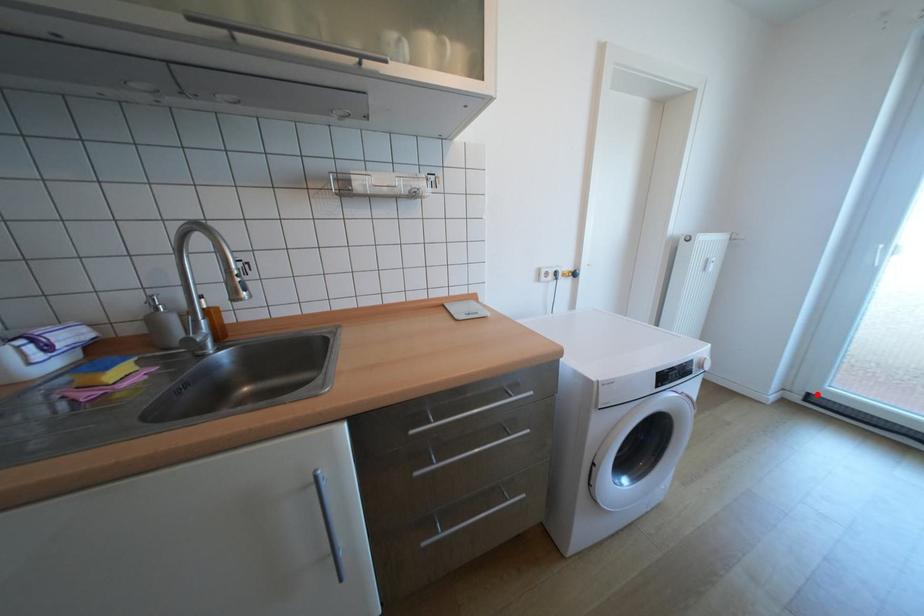
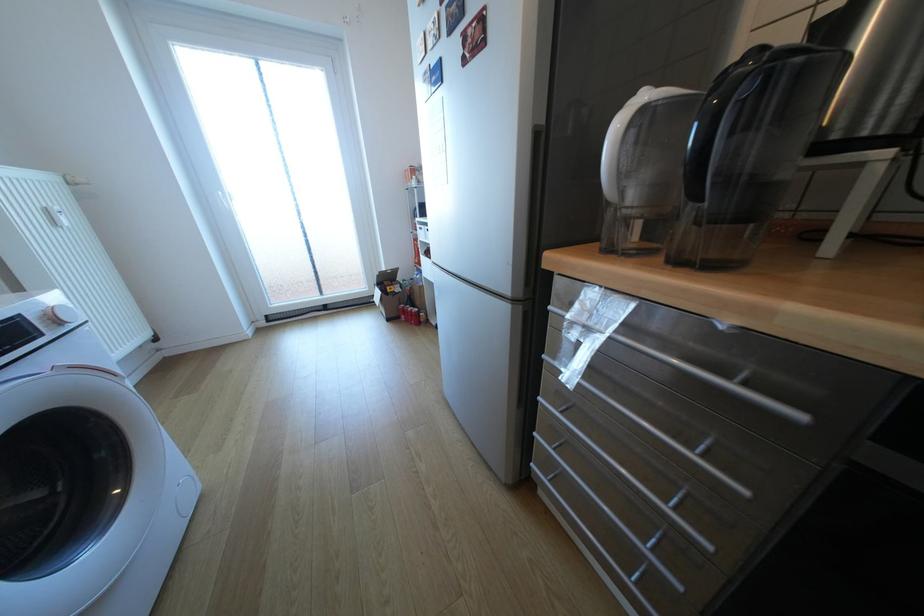
Question: I am providing you with two images of the same scene from different viewpoints. A red point is shown in image1. For the corresponding object point in image2, is it positioned nearer or farther from the camera?

Choices:
 (A) Nearer
 (B) Farther

Answer: (A)